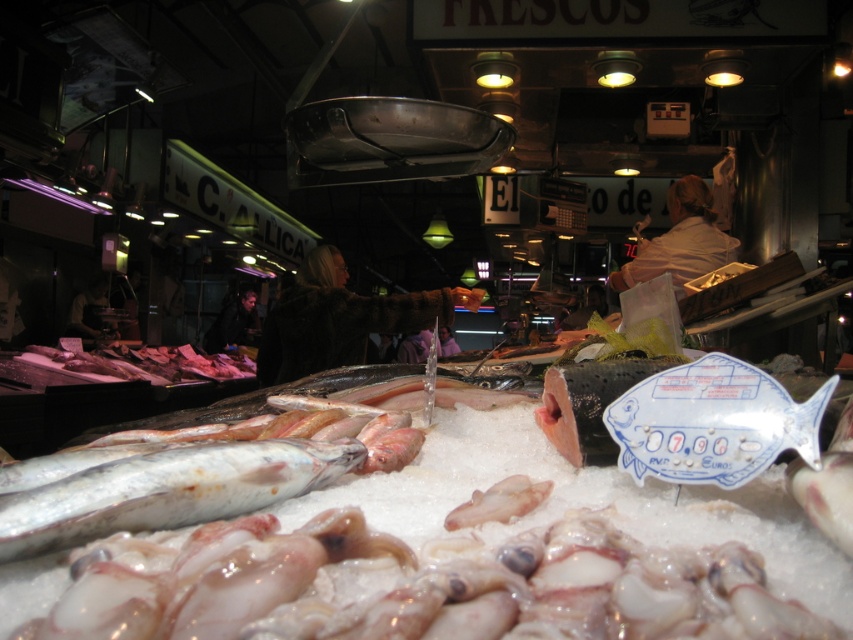
Question: Which object is farther from the camera taking this photo?

Choices:
 (A) translucent white fish at center
 (B) translucent pinkish flesh at center

Answer: (B)

Question: Is translucent white fish at center bigger than translucent pinkish flesh at center?

Choices:
 (A) no
 (B) yes

Answer: (B)

Question: Can you confirm if translucent white fish at center is positioned above translucent pinkish flesh at center?

Choices:
 (A) yes
 (B) no

Answer: (A)

Question: Which object is farther from the camera taking this photo?

Choices:
 (A) translucent pinkish flesh at center
 (B) translucent white fish at center

Answer: (A)

Question: Does translucent white fish at center appear under translucent pinkish flesh at center?

Choices:
 (A) yes
 (B) no

Answer: (B)